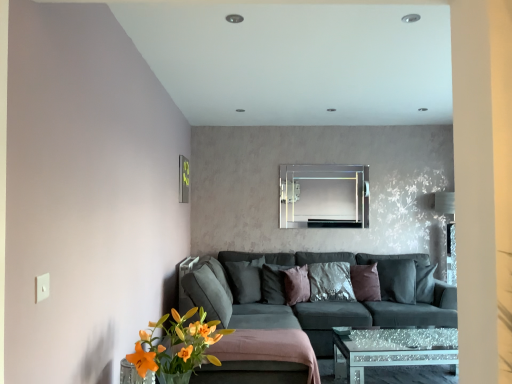
Question: Considering the positions of dark gray fabric pillow at center, arranged as the first pillow when viewed from the left, and orange matte flower at lower left in the image, is dark gray fabric pillow at center, arranged as the first pillow when viewed from the left, taller or shorter than orange matte flower at lower left?

Choices:
 (A) tall
 (B) short

Answer: (A)

Question: Is dark gray fabric pillow at center, which appears as the fourth pillow when viewed from the right, inside or outside of orange matte flower at lower left?

Choices:
 (A) outside
 (B) inside

Answer: (A)

Question: Considering the real-world distances, which object is closest to the orange matte flower at lower left?

Choices:
 (A) metallic rectangular frame at upper left
 (B) dark gray fabric pillow at center, arranged as the first pillow when viewed from the left
 (C) velvet purple pillow at center, the second pillow when ordered from right to left
 (D) clear glass mirror at center
 (E) purple velvet pillow at center, acting as the 2th pillow starting from the left

Answer: (B)

Question: Which is farther from the orange matte flower at lower left?

Choices:
 (A) shiny metallic pillow at center, which appears as the first pillow when viewed from the right
 (B) clear glass mirror at center
 (C) velvet purple pillow at center, marked as the 3th pillow in a left-to-right arrangement
 (D) purple velvet pillow at center, marked as the 3th pillow in a right-to-left arrangement
 (E) metallic rectangular frame at upper left

Answer: (B)